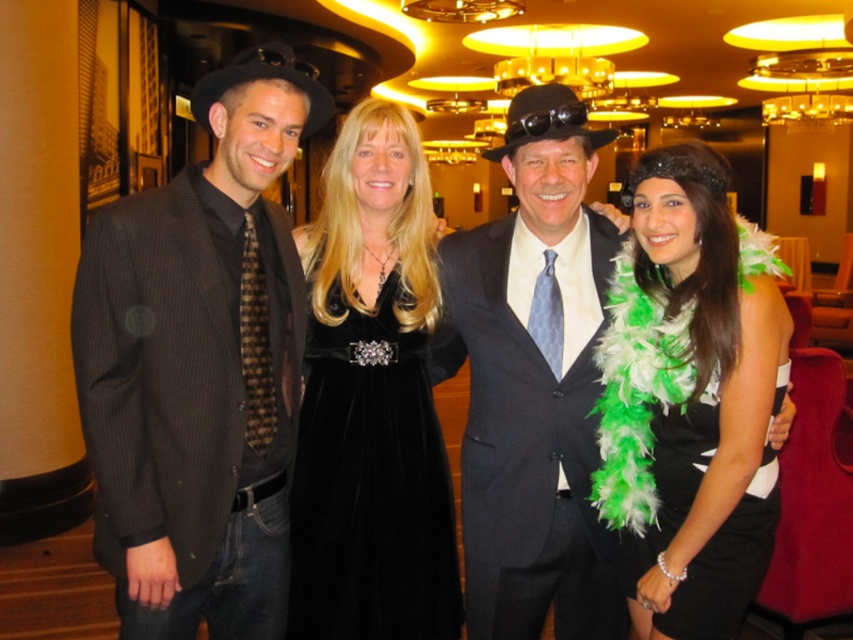
You are a photographer at the event and need to adjust the lighting to ensure both the white feather boa at center and the velvet black dress at center are well lit. Considering their height difference, which object should you focus on first to ensure proper exposure?

The white feather boa at center is taller than the velvet black dress at center, so you should focus on the white feather boa at center first to ensure proper exposure, as it occupies a higher position and may require more light adjustment.

In the scene shown: You are a photographer at the event and need to adjust the lighting so that both the white feather boa at center and the velvet black dress at center are evenly illuminated. Given their current positions, how far apart are these two items?

The white feather boa at center is 56.65 centimeters from the velvet black dress at center, so the photographer should ensure the lighting covers this distance to evenly illuminate both items.